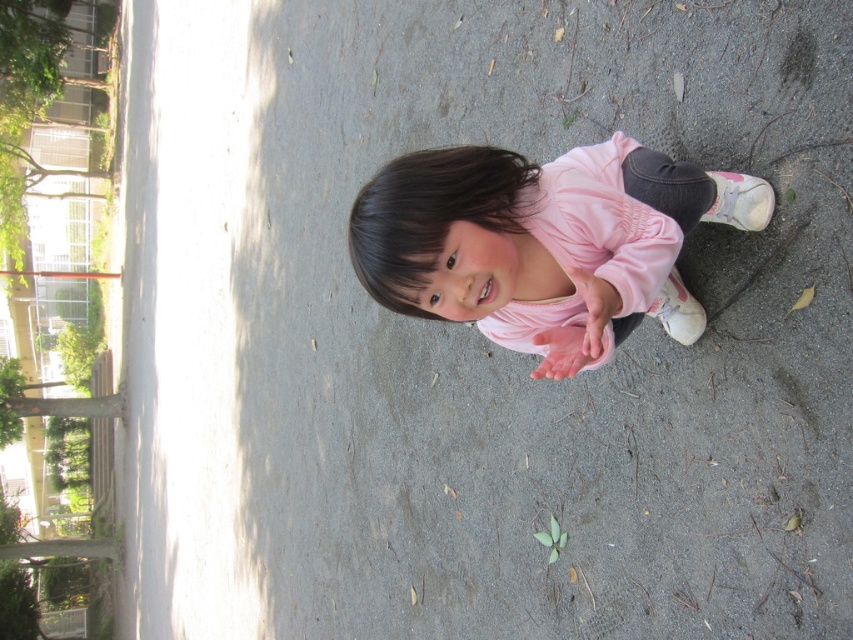
Does pink matte shirt at center have a smaller size compared to pink matte dress at center?

No, pink matte shirt at center is not smaller than pink matte dress at center.

Which is below, pink matte shirt at center or pink matte dress at center?

pink matte shirt at center is below.

Does point (671, 305) come behind point (552, 332)?

Yes, point (671, 305) is behind point (552, 332).

You are a GUI agent. You are given a task and a screenshot of the screen. Output one action in this format:
    pyautogui.click(x=<x>, y=<y>)
    Task: Click on the pink matte shirt at center
    
    Given the screenshot: What is the action you would take?
    pyautogui.click(x=544, y=243)